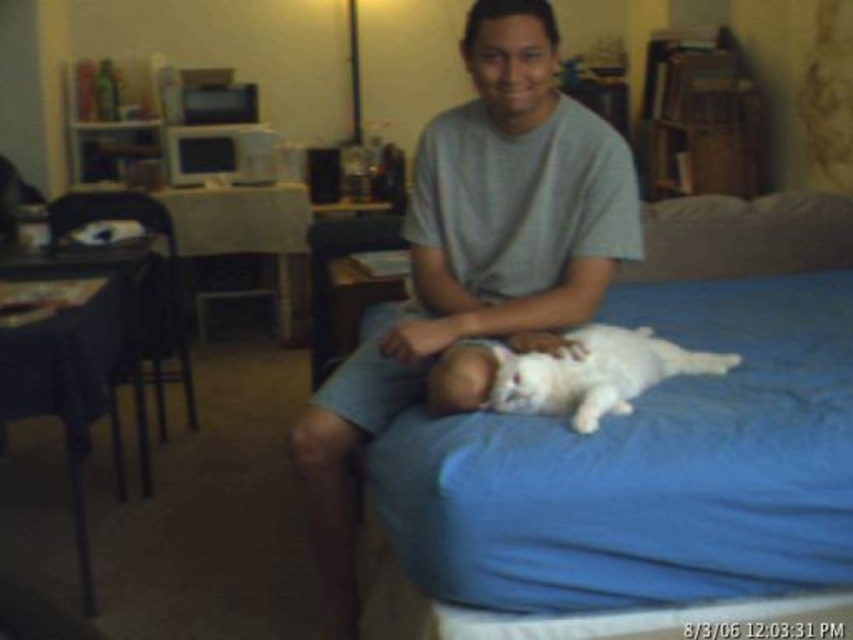
Identify the location of blue fabric bed at center. This screenshot has height=640, width=853. click(x=645, y=445).

Between point (682, 300) and point (612, 401), which one is positioned behind?

The point (682, 300) is behind.

What do you see at coordinates (645, 445) in the screenshot? This screenshot has height=640, width=853. I see `blue fabric bed at center` at bounding box center [645, 445].

This screenshot has height=640, width=853. Find the location of `blue fabric bed at center`. blue fabric bed at center is located at coordinates (645, 445).

Is point (339, 429) positioned behind point (683, 202)?

That is False.

Who is more distant from viewer, (497, 333) or (764, 228)?

Point (764, 228)

At what (x,y) coordinates should I click in order to perform the action: click on gray cotton shirt at center. Please return your answer as a coordinate pair (x, y). Looking at the image, I should click on (476, 260).

Is point (646, 595) behind point (746, 236)?

No.

Does blue fabric bed at center appear over blue fabric pillow at upper right?

No.

You are a GUI agent. You are given a task and a screenshot of the screen. Output one action in this format:
    pyautogui.click(x=<x>, y=<y>)
    Task: Click on the blue fabric bed at center
    This screenshot has width=853, height=640.
    Given the screenshot: What is the action you would take?
    pyautogui.click(x=645, y=445)

Locate an element on the screen. blue fabric bed at center is located at coordinates (645, 445).